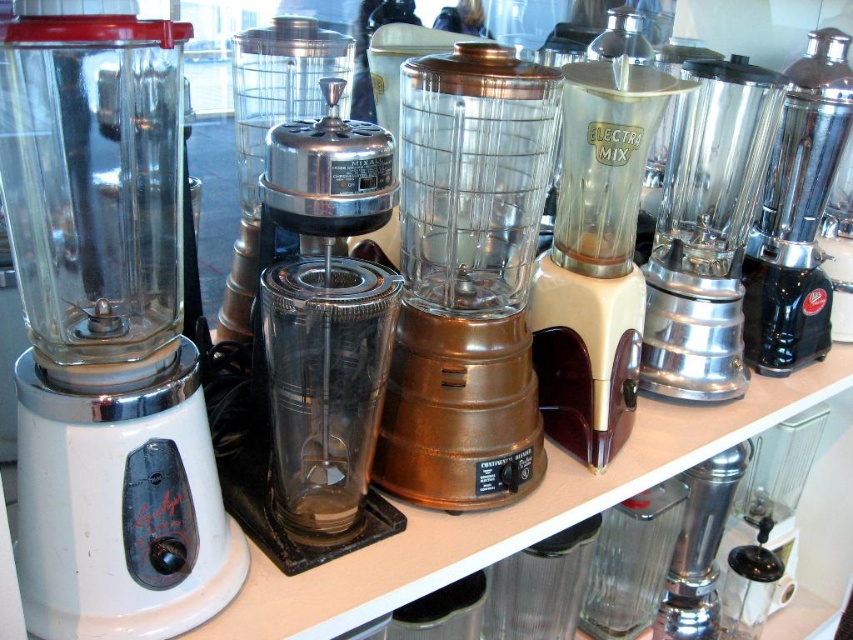
You are organizing a kitchen appliance display and need to place a new small blender on the shelf. The shiny chrome mixer at center and the shiny metallic blender at right are already there. Based on their sizes, where should you place the new small blender?

The shiny chrome mixer at center is larger than the shiny metallic blender at right, so the new small blender should be placed next to the shiny metallic blender at right since it is smaller.

You are organizing a kitchen appliance display and need to place a new item between the shiny metallic blender at right and the polished stainless steel mixer at right. However, there isn

The shiny metallic blender at right is to the left of the polished stainless steel mixer at right, so you can place the new item between them by positioning it to the right of the shiny metallic blender at right and to the left of the polished stainless steel mixer at right.

You are standing in front of a shelf displaying vintage blenders. You notice two points marked on the shelf at coordinates point (286,250) and point (680,216). Which point is nearer to you?

Point (286,250) is closer to the viewer than point (680,216).